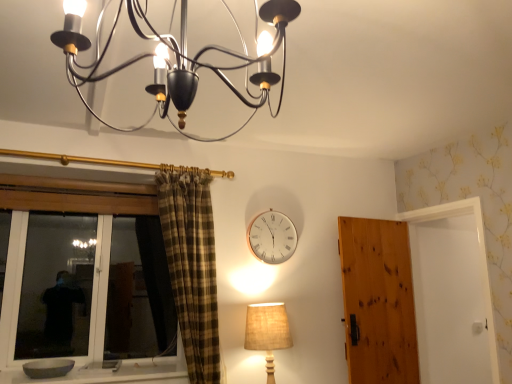
Question: Is wooden door at right inside the boundaries of metallic chandelier at upper center, which is counted as the 1th lamp, starting from the front, or outside?

Choices:
 (A) inside
 (B) outside

Answer: (B)

Question: Is wooden door at right taller or shorter than metallic chandelier at upper center, the 2th lamp in the bottom-to-top sequence?

Choices:
 (A) tall
 (B) short

Answer: (A)

Question: Based on their relative distances, which object is nearer to the white metallic clock at upper center?

Choices:
 (A) gray stone bowl at lower left
 (B) burlap beige lampshade at lower right, the first lamp from the bottom
 (C) metallic chandelier at upper center, the 2th lamp in the bottom-to-top sequence
 (D) wooden door at right

Answer: (B)

Question: Which object is positioned farthest from the metallic chandelier at upper center, the 1th lamp from the top?

Choices:
 (A) white metallic clock at upper center
 (B) burlap beige lampshade at lower right, acting as the 1th lamp starting from the back
 (C) gray stone bowl at lower left
 (D) wooden door at right

Answer: (C)